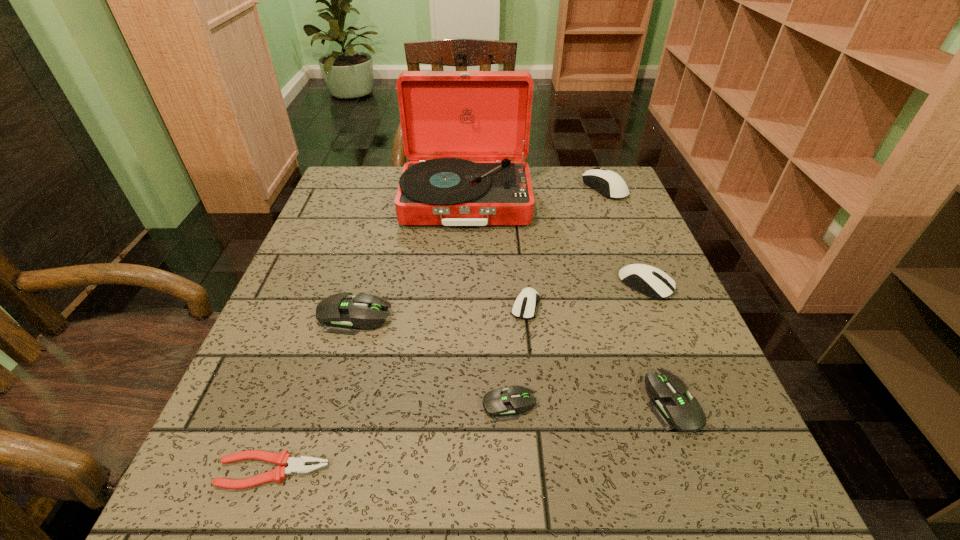
This screenshot has width=960, height=540. What are the coordinates of `the tallest object` in the screenshot? It's located at (447, 118).

Locate an element on the screen. This screenshot has width=960, height=540. the seventh shortest object is located at coordinates (597, 178).

You are a GUI agent. You are given a task and a screenshot of the screen. Output one action in this format:
    pyautogui.click(x=<x>, y=<y>)
    Task: Click on the farthest white mouse
    The image size is (960, 540).
    Given the screenshot: What is the action you would take?
    pyautogui.click(x=597, y=178)

Where is `the second smallest white mouse`? The width and height of the screenshot is (960, 540). the second smallest white mouse is located at coordinates (651, 281).

I want to click on the leftmost gray computer mouse, so click(339, 313).

I want to click on the farthest gray computer mouse, so click(339, 313).

Identify the location of the smallest white mouse. (524, 307).

Image resolution: width=960 pixels, height=540 pixels. I want to click on the rightmost gray computer mouse, so [x=675, y=408].

Where is `the second gray computer mouse from left to right`? This screenshot has height=540, width=960. the second gray computer mouse from left to right is located at coordinates (502, 404).

Where is `the smallest gray computer mouse`? The image size is (960, 540). the smallest gray computer mouse is located at coordinates (502, 404).